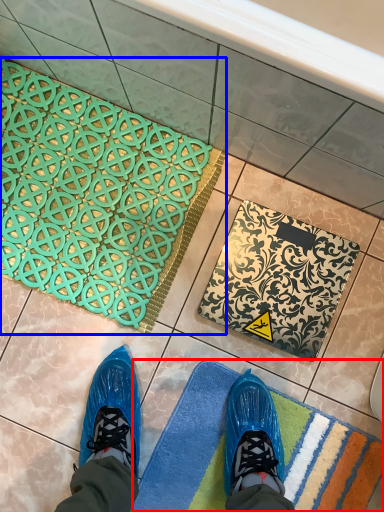
Question: Which object is further to the camera taking this photo, bath mat (highlighted by a red box) or bath mat (highlighted by a blue box)?

Choices:
 (A) bath mat
 (B) bath mat

Answer: (B)